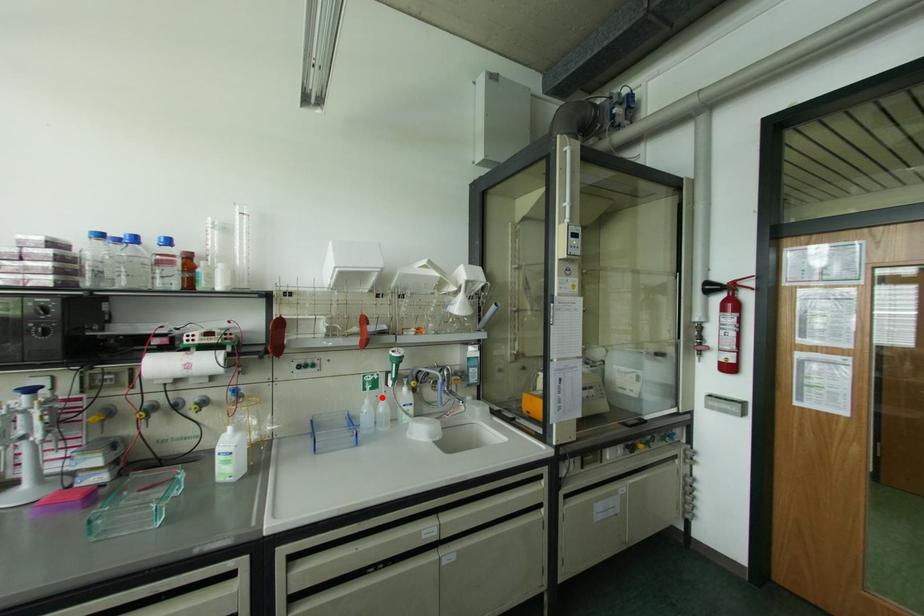
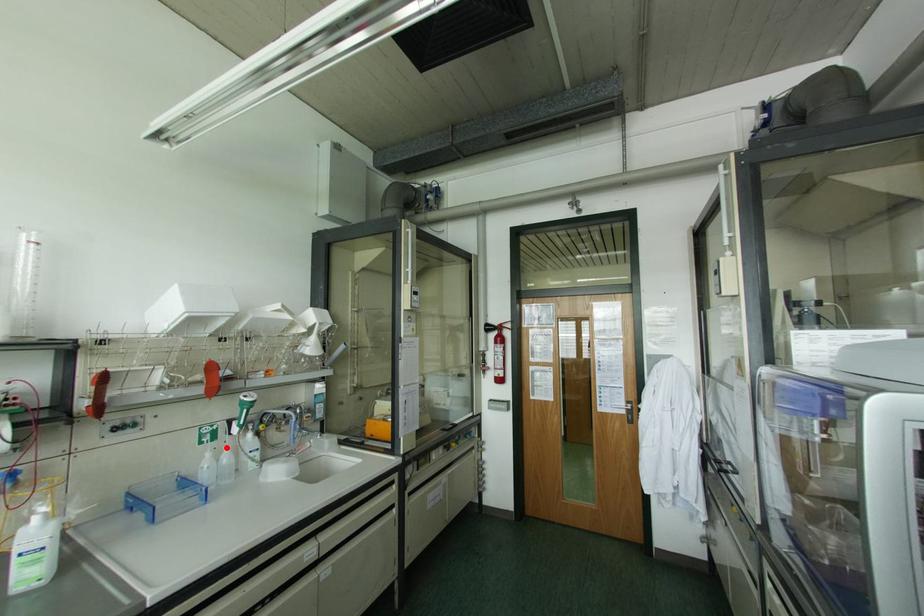
I am providing you with two images of the same scene from different viewpoints. A red point is marked on the first image and another point is marked on the second image. Do the highlighted points in image1 and image2 indicate the same real-world spot?

Yes